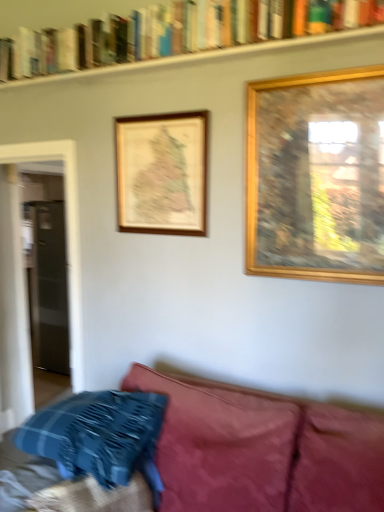
The width and height of the screenshot is (384, 512). What are the coordinates of `clear glass door at left` in the screenshot? It's located at (49, 287).

This screenshot has height=512, width=384. Describe the element at coordinates (179, 34) in the screenshot. I see `hardcover books at upper center` at that location.

Find the location of `blue plaid pillow at lower left`. blue plaid pillow at lower left is located at coordinates (99, 436).

The image size is (384, 512). I want to click on gold wooden picture frame at upper right, acting as the 1th picture frame starting from the front, so coord(316,176).

Where is `wooden map at upper center, which appears as the 2th picture frame when viewed from the right`? wooden map at upper center, which appears as the 2th picture frame when viewed from the right is located at coordinates (162, 173).

From a real-world perspective, which object stands above the other?

From a 3D spatial view, hardcover books at upper center is above.

From the image's perspective, between hardcover books at upper center and clear glass door at left, who is located below?

clear glass door at left appears lower in the image.

Who is more distant, hardcover books at upper center or clear glass door at left?

clear glass door at left is further from the camera.

Which of these two, hardcover books at upper center or clear glass door at left, is wider?

hardcover books at upper center is wider.

At what (x,y) coordinates should I click in order to perform the action: click on pillow in front of the hardcover books at upper center. Please return your answer as a coordinate pair (x, y). Looking at the image, I should click on (99, 436).

What's the angular difference between hardcover books at upper center and blue plaid pillow at lower left's facing directions?

hardcover books at upper center and blue plaid pillow at lower left are facing 0.705 degrees away from each other.

Is blue plaid pillow at lower left located within hardcover books at upper center?

No, hardcover books at upper center does not contain blue plaid pillow at lower left.

Does point (188, 153) come behind point (43, 257)?

No.

Is wooden map at upper center, which is counted as the first picture frame, starting from the left, facing towards clear glass door at left?

No, wooden map at upper center, which is counted as the first picture frame, starting from the left, is not turned towards clear glass door at left.

Is the depth of wooden map at upper center, the second picture frame viewed from the front, less than that of clear glass door at left?

Yes, it is.

Can clear glass door at left be found inside wooden map at upper center, which is counted as the first picture frame, starting from the left?

No, wooden map at upper center, which is counted as the first picture frame, starting from the left, does not contain clear glass door at left.

Based on the photo, is clear glass door at left at the left side of gold wooden picture frame at upper right, the 2th picture frame from the left?

Yes, clear glass door at left is to the left of gold wooden picture frame at upper right, the 2th picture frame from the left.

Where is `glass door below the gold wooden picture frame at upper right, which is the 1th picture frame in right-to-left order (from a real-world perspective)`? The height and width of the screenshot is (512, 384). glass door below the gold wooden picture frame at upper right, which is the 1th picture frame in right-to-left order (from a real-world perspective) is located at coordinates (49, 287).

How different are the orientations of clear glass door at left and gold wooden picture frame at upper right, which is the 1th picture frame in right-to-left order, in degrees?

There is a 1.64-degree angle between the facing directions of clear glass door at left and gold wooden picture frame at upper right, which is the 1th picture frame in right-to-left order.

Which is more to the right, gold wooden picture frame at upper right, acting as the 1th picture frame starting from the front, or wooden map at upper center, which is counted as the first picture frame, starting from the left?

From the viewer's perspective, gold wooden picture frame at upper right, acting as the 1th picture frame starting from the front, appears more on the right side.

Is gold wooden picture frame at upper right, arranged as the 2th picture frame when viewed from the back, not near wooden map at upper center, which appears as the 2th picture frame when viewed from the right?

No, gold wooden picture frame at upper right, arranged as the 2th picture frame when viewed from the back, is in close proximity to wooden map at upper center, which appears as the 2th picture frame when viewed from the right.

Is gold wooden picture frame at upper right, acting as the 1th picture frame starting from the front, facing away from wooden map at upper center, the second picture frame viewed from the front?

No, gold wooden picture frame at upper right, acting as the 1th picture frame starting from the front, is not facing the opposite direction of wooden map at upper center, the second picture frame viewed from the front.

Which object is more forward, gold wooden picture frame at upper right, acting as the 1th picture frame starting from the front, or wooden map at upper center, the 1th picture frame in the back-to-front sequence?

gold wooden picture frame at upper right, acting as the 1th picture frame starting from the front, is more forward.

Could you tell me if blue plaid pillow at lower left is turned towards wooden map at upper center, the second picture frame viewed from the front?

No, blue plaid pillow at lower left is not turned towards wooden map at upper center, the second picture frame viewed from the front.

Is blue plaid pillow at lower left situated inside wooden map at upper center, which is counted as the first picture frame, starting from the left, or outside?

blue plaid pillow at lower left exists outside the volume of wooden map at upper center, which is counted as the first picture frame, starting from the left.

From the image's perspective, is blue plaid pillow at lower left above or below wooden map at upper center, which appears as the 2th picture frame when viewed from the right?

Clearly, from the image's perspective, blue plaid pillow at lower left is below wooden map at upper center, which appears as the 2th picture frame when viewed from the right.

Which of these two, blue plaid pillow at lower left or wooden map at upper center, the second picture frame viewed from the front, is smaller?

With smaller size is wooden map at upper center, the second picture frame viewed from the front.

Is clear glass door at left positioned behind blue plaid pillow at lower left?

Yes, clear glass door at left is further from the viewer.

Based on their sizes in the image, would you say clear glass door at left is bigger or smaller than blue plaid pillow at lower left?

Considering their sizes, clear glass door at left takes up less space than blue plaid pillow at lower left.

From a real-world perspective, is clear glass door at left above or below blue plaid pillow at lower left?

From a real-world perspective, clear glass door at left is physically above blue plaid pillow at lower left.

Find the location of a particular element. book in front of the clear glass door at left is located at coordinates (179, 34).

This screenshot has height=512, width=384. Find the location of `pillow to the left of hardcover books at upper center`. pillow to the left of hardcover books at upper center is located at coordinates (99, 436).

When comparing their distances from clear glass door at left, does wooden map at upper center, which appears as the 2th picture frame when viewed from the right, or hardcover books at upper center seem further?

hardcover books at upper center is positioned further to the anchor clear glass door at left.

Considering their positions, is clear glass door at left positioned closer to hardcover books at upper center than wooden map at upper center, the second picture frame viewed from the front?

The object closer to hardcover books at upper center is wooden map at upper center, the second picture frame viewed from the front.

When comparing their distances from gold wooden picture frame at upper right, acting as the 1th picture frame starting from the front, does hardcover books at upper center or clear glass door at left seem further?

The object further to gold wooden picture frame at upper right, acting as the 1th picture frame starting from the front, is clear glass door at left.

When comparing their distances from hardcover books at upper center, does clear glass door at left or blue plaid pillow at lower left seem closer?

The object closer to hardcover books at upper center is blue plaid pillow at lower left.

Looking at this image, when comparing their distances from clear glass door at left, does blue plaid pillow at lower left or hardcover books at upper center seem further?

Among the two, blue plaid pillow at lower left is located further to clear glass door at left.

When comparing their distances from gold wooden picture frame at upper right, the 2th picture frame from the left, does wooden map at upper center, which appears as the 2th picture frame when viewed from the right, or blue plaid pillow at lower left seem further?

blue plaid pillow at lower left is positioned further to the anchor gold wooden picture frame at upper right, the 2th picture frame from the left.

From the image, which object appears to be nearer to gold wooden picture frame at upper right, the 2th picture frame from the left, blue plaid pillow at lower left or clear glass door at left?

Based on the image, blue plaid pillow at lower left appears to be nearer to gold wooden picture frame at upper right, the 2th picture frame from the left.

From the picture: Estimate the real-world distances between objects in this image. Which object is closer to clear glass door at left, wooden map at upper center, which appears as the 2th picture frame when viewed from the right, or blue plaid pillow at lower left?

wooden map at upper center, which appears as the 2th picture frame when viewed from the right, lies closer to clear glass door at left than the other object.

Where is `book positioned between blue plaid pillow at lower left and clear glass door at left from near to far`? The width and height of the screenshot is (384, 512). book positioned between blue plaid pillow at lower left and clear glass door at left from near to far is located at coordinates (179, 34).

Find the location of a particular element. picture frame between hardcover books at upper center and gold wooden picture frame at upper right, arranged as the 2th picture frame when viewed from the back, in the horizontal direction is located at coordinates (162, 173).

This screenshot has width=384, height=512. Find the location of `picture frame between gold wooden picture frame at upper right, acting as the 1th picture frame starting from the front, and clear glass door at left in the front-back direction`. picture frame between gold wooden picture frame at upper right, acting as the 1th picture frame starting from the front, and clear glass door at left in the front-back direction is located at coordinates (162, 173).

The image size is (384, 512). Identify the location of picture frame that lies between wooden map at upper center, the second picture frame viewed from the front, and blue plaid pillow at lower left from top to bottom. (316, 176).